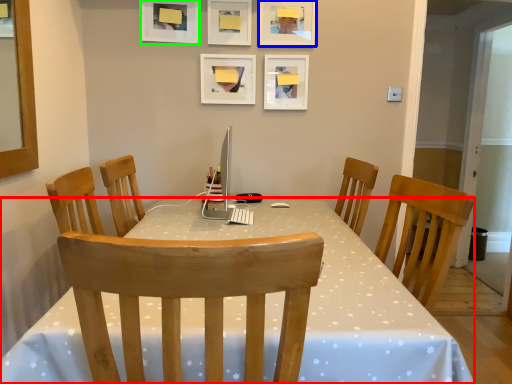
Question: Estimate the real-world distances between objects in this image. Which object is farther from desk (highlighted by a red box), picture frame (highlighted by a blue box) or picture frame (highlighted by a green box)?

Choices:
 (A) picture frame
 (B) picture frame

Answer: (B)